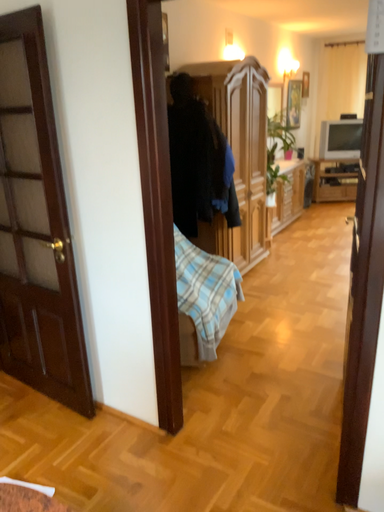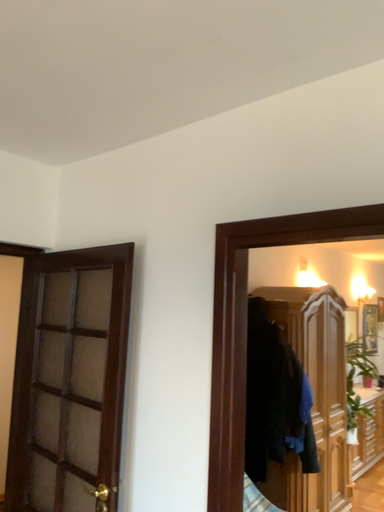
Question: Which way did the camera rotate in the video?

Choices:
 (A) rotated upward
 (B) rotated downward

Answer: (A)